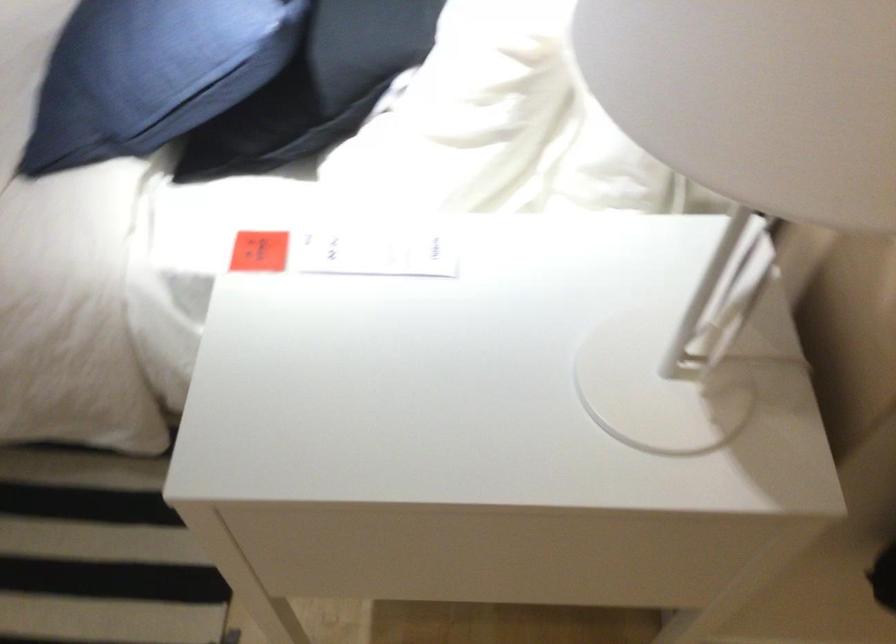
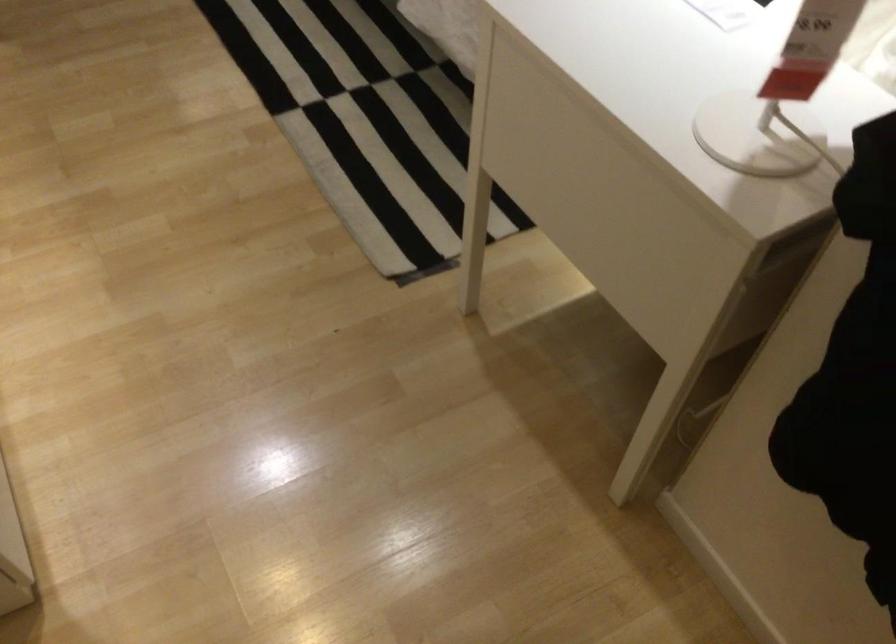
Question: The images are taken continuously from a first-person perspective. In which direction is your viewpoint rotating?

Choices:
 (A) Left
 (B) Right
 (C) Up
 (D) Down

Answer: (A)